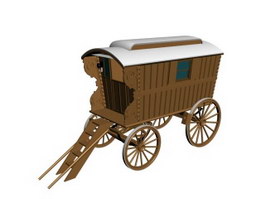
Find the location of `stairs`. stairs is located at coordinates (86, 136).